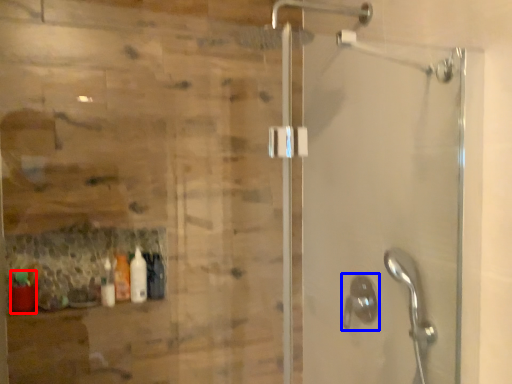
Question: Among these objects, which one is nearest to the camera, bottle (highlighted by a red box) or shower (highlighted by a blue box)?

Choices:
 (A) bottle
 (B) shower

Answer: (B)